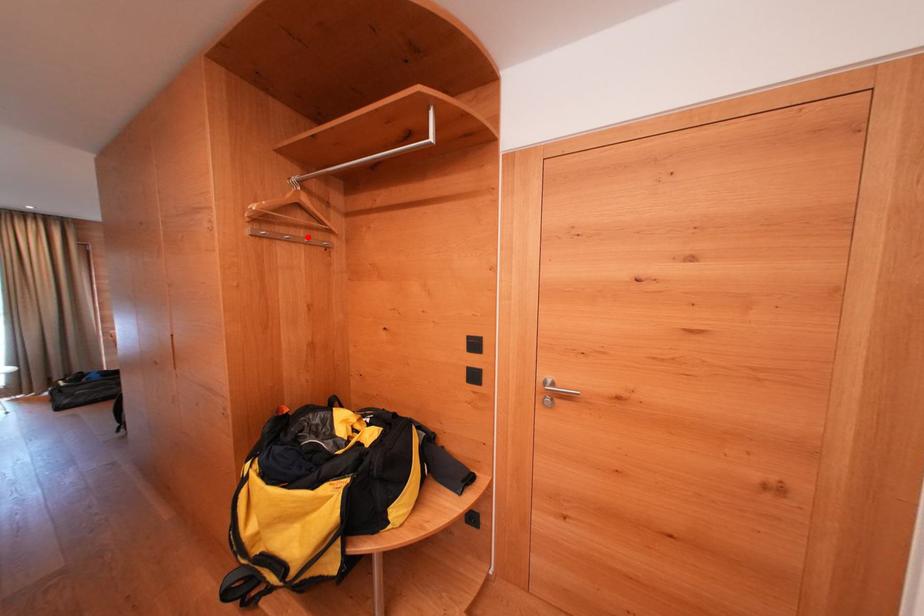
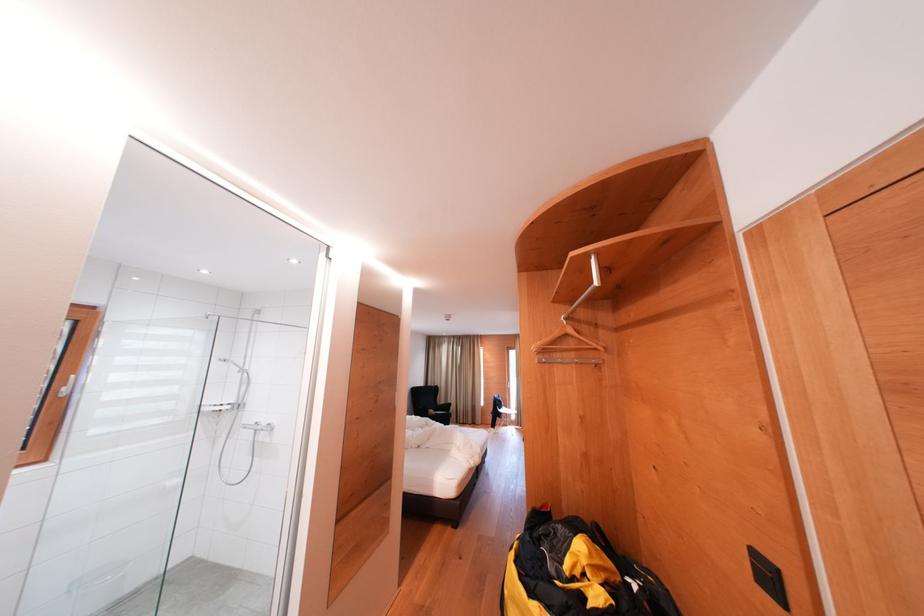
Locate, in the second image, the point that corresponds to the highlighted location in the first image.

(579, 359)